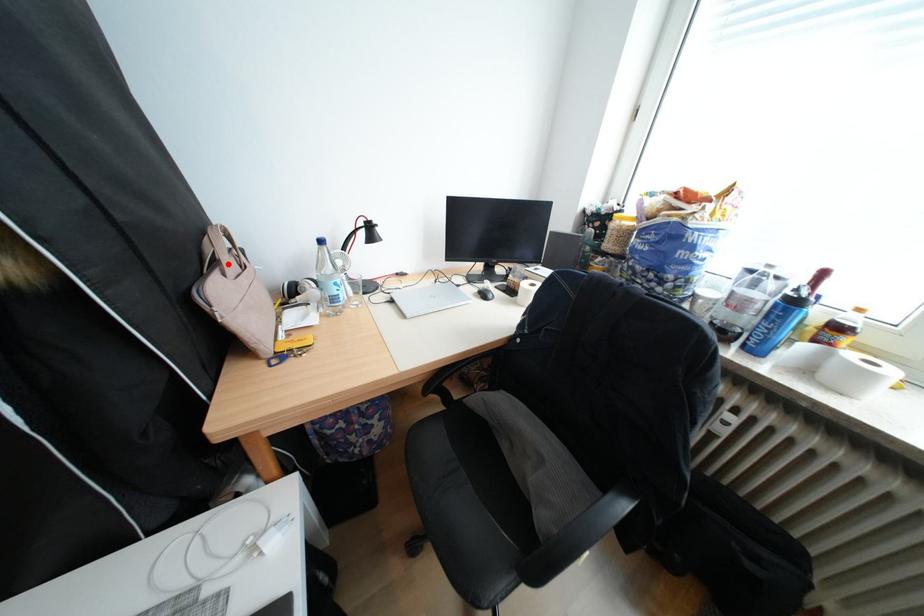
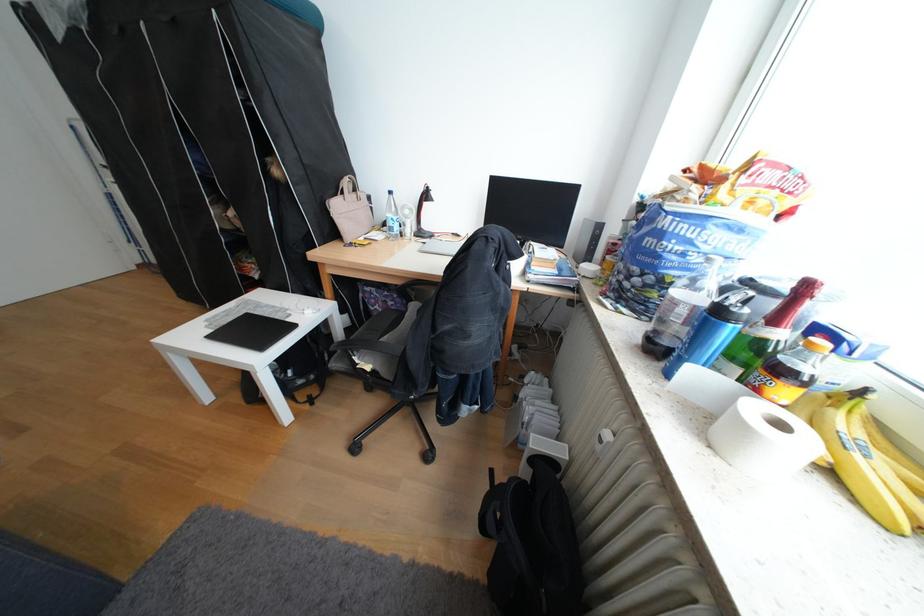
Locate, in the second image, the point that corresponds to the highlighted location in the first image.

(355, 193)